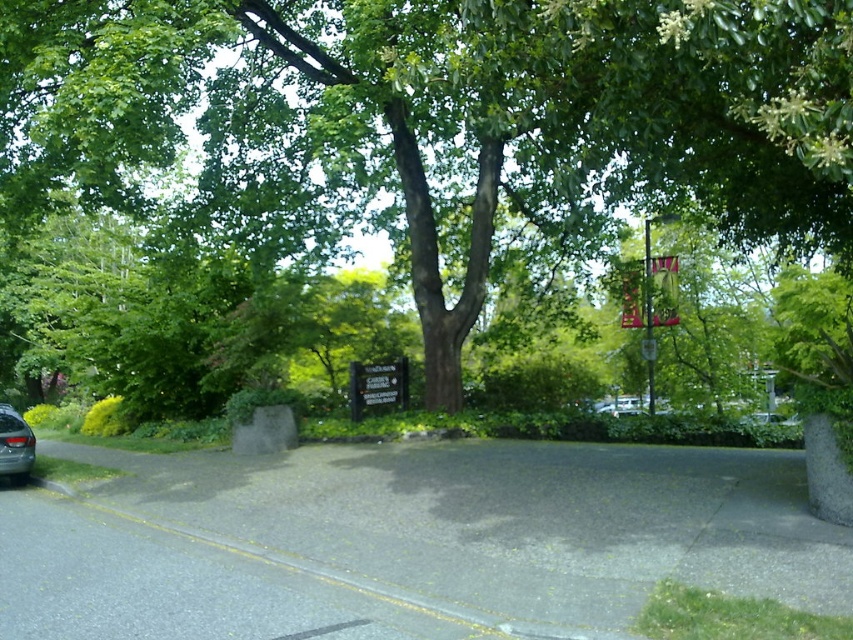
Question: Can you confirm if green leafy tree at center is wider than silver metallic car at lower left?

Choices:
 (A) yes
 (B) no

Answer: (A)

Question: Which of the following is the farthest from the observer?

Choices:
 (A) coord(361,122)
 (B) coord(10,436)

Answer: (B)

Question: Does green leafy tree at center appear over silver metallic car at lower left?

Choices:
 (A) yes
 (B) no

Answer: (A)

Question: Which object appears farthest from the camera in this image?

Choices:
 (A) silver metallic car at lower left
 (B) green leafy tree at center

Answer: (A)

Question: Where is green leafy tree at center located in relation to silver metallic car at lower left in the image?

Choices:
 (A) above
 (B) below

Answer: (A)

Question: Among these objects, which one is nearest to the camera?

Choices:
 (A) green leafy tree at center
 (B) silver metallic car at lower left

Answer: (A)